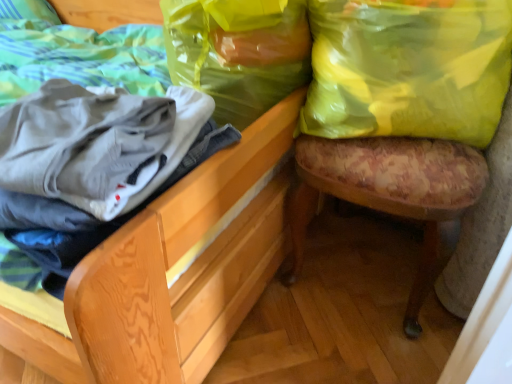
This screenshot has height=384, width=512. What do you see at coordinates (408, 69) in the screenshot?
I see `yellow plastic bag at upper right, which is the 2th shopping bag in left-to-right order` at bounding box center [408, 69].

At what (x,y) coordinates should I click in order to perform the action: click on wooden chair at lower right. Please return your answer as a coordinate pair (x, y). The image size is (512, 384). Looking at the image, I should click on (224, 195).

Image resolution: width=512 pixels, height=384 pixels. Describe the element at coordinates (224, 195) in the screenshot. I see `wooden chair at lower right` at that location.

What do you see at coordinates (238, 52) in the screenshot? I see `translucent yellow plastic bag at upper right, the 1th shopping bag viewed from the left` at bounding box center [238, 52].

Locate an element on the screen. Image resolution: width=512 pixels, height=384 pixels. yellow plastic bag at upper right, which ranks as the 1th shopping bag in right-to-left order is located at coordinates (408, 69).

From the picture: Is floral fabric stool at right taller than wooden chair at lower right?

Incorrect, the height of floral fabric stool at right is not larger of that of wooden chair at lower right.

Is floral fabric stool at right not within wooden chair at lower right?

floral fabric stool at right is positioned outside wooden chair at lower right.

How distant is floral fabric stool at right from wooden chair at lower right?

floral fabric stool at right and wooden chair at lower right are 9.88 inches apart.

Can you confirm if floral fabric stool at right is positioned to the left of wooden chair at lower right?

No.

In terms of width, does translucent yellow plastic bag at upper right, the 1th shopping bag viewed from the left, look wider or thinner when compared to yellow plastic bag at upper right, which is the 2th shopping bag in left-to-right order?

Considering their sizes, translucent yellow plastic bag at upper right, the 1th shopping bag viewed from the left, looks broader than yellow plastic bag at upper right, which is the 2th shopping bag in left-to-right order.

Which is behind, point (249, 103) or point (395, 14)?

The point (249, 103) is farther from the camera.

Is translucent yellow plastic bag at upper right, the 1th shopping bag viewed from the left, far from yellow plastic bag at upper right, which is the 2th shopping bag in left-to-right order?

No.

Consider the image. Relative to yellow plastic bag at upper right, which is the 2th shopping bag in left-to-right order, is translucent yellow plastic bag at upper right, the 1th shopping bag viewed from the left, in front or behind?

translucent yellow plastic bag at upper right, the 1th shopping bag viewed from the left, is behind yellow plastic bag at upper right, which is the 2th shopping bag in left-to-right order.

Relative to wooden chair at lower right, is translucent yellow plastic bag at upper right, the 1th shopping bag viewed from the left, in front or behind?

translucent yellow plastic bag at upper right, the 1th shopping bag viewed from the left, is behind wooden chair at lower right.

Could you tell me if translucent yellow plastic bag at upper right, the 1th shopping bag viewed from the left, is turned towards wooden chair at lower right?

Yes, translucent yellow plastic bag at upper right, the 1th shopping bag viewed from the left, is turned towards wooden chair at lower right.

Is translucent yellow plastic bag at upper right, the 1th shopping bag viewed from the left, far away from wooden chair at lower right?

They are positioned close to each other.

You are a GUI agent. You are given a task and a screenshot of the screen. Output one action in this format:
    pyautogui.click(x=<x>, y=<y>)
    Task: Click on the furniture below the translucent yellow plastic bag at upper right, the 1th shopping bag viewed from the left (from the image's perspective)
    Image resolution: width=512 pixels, height=384 pixels.
    Given the screenshot: What is the action you would take?
    pyautogui.click(x=224, y=195)

Is yellow plastic bag at upper right, which ranks as the 1th shopping bag in right-to-left order, not near wooden chair at lower right?

yellow plastic bag at upper right, which ranks as the 1th shopping bag in right-to-left order, is near wooden chair at lower right, not far away.

Considering the relative positions of yellow plastic bag at upper right, which is the 2th shopping bag in left-to-right order, and wooden chair at lower right in the image provided, is yellow plastic bag at upper right, which is the 2th shopping bag in left-to-right order, to the right of wooden chair at lower right from the viewer's perspective?

Correct, you'll find yellow plastic bag at upper right, which is the 2th shopping bag in left-to-right order, to the right of wooden chair at lower right.

From the image's perspective, is yellow plastic bag at upper right, which ranks as the 1th shopping bag in right-to-left order, on wooden chair at lower right?

Incorrect, from the image's perspective, yellow plastic bag at upper right, which ranks as the 1th shopping bag in right-to-left order, is lower than wooden chair at lower right.

Does floral fabric stool at right appear on the left side of translucent yellow plastic bag at upper right, the 1th shopping bag viewed from the left?

No.

Does floral fabric stool at right have a lesser height compared to translucent yellow plastic bag at upper right, the 1th shopping bag viewed from the left?

No.

Looking at the image, does floral fabric stool at right seem bigger or smaller compared to translucent yellow plastic bag at upper right, which is the second shopping bag in right-to-left order?

Clearly, floral fabric stool at right is larger in size than translucent yellow plastic bag at upper right, which is the second shopping bag in right-to-left order.

Would you say floral fabric stool at right is outside translucent yellow plastic bag at upper right, the 1th shopping bag viewed from the left?

Yes.

From the image's perspective, would you say translucent yellow plastic bag at upper right, which is the second shopping bag in right-to-left order, is positioned over floral fabric stool at right?

Yes.

Would you say translucent yellow plastic bag at upper right, which is the second shopping bag in right-to-left order, contains floral fabric stool at right?

No, floral fabric stool at right is not surrounded by translucent yellow plastic bag at upper right, which is the second shopping bag in right-to-left order.

Is translucent yellow plastic bag at upper right, the 1th shopping bag viewed from the left, positioned before floral fabric stool at right?

No, the depth of translucent yellow plastic bag at upper right, the 1th shopping bag viewed from the left, is greater than that of floral fabric stool at right.

Are wooden chair at lower right and translucent yellow plastic bag at upper right, which is the second shopping bag in right-to-left order, located far from each other?

That's not correct — wooden chair at lower right is a little close to translucent yellow plastic bag at upper right, which is the second shopping bag in right-to-left order.

Considering the relative sizes of wooden chair at lower right and translucent yellow plastic bag at upper right, which is the second shopping bag in right-to-left order, in the image provided, is wooden chair at lower right bigger than translucent yellow plastic bag at upper right, which is the second shopping bag in right-to-left order,?

Indeed, wooden chair at lower right has a larger size compared to translucent yellow plastic bag at upper right, which is the second shopping bag in right-to-left order.

In the scene shown: How much distance is there between wooden chair at lower right and translucent yellow plastic bag at upper right, the 1th shopping bag viewed from the left?

The distance of wooden chair at lower right from translucent yellow plastic bag at upper right, the 1th shopping bag viewed from the left, is 8.59 inches.

Which is in front, point (4, 343) or point (210, 64)?

The point (4, 343) is closer to the camera.

Find the location of a particular element. The height and width of the screenshot is (384, 512). furniture lying above the floral fabric stool at right (from the image's perspective) is located at coordinates (224, 195).

The image size is (512, 384). What are the coordinates of `shopping bag behind the yellow plastic bag at upper right, which ranks as the 1th shopping bag in right-to-left order` in the screenshot? It's located at [238, 52].

Looking at the image, which one is located further to translucent yellow plastic bag at upper right, the 1th shopping bag viewed from the left, yellow plastic bag at upper right, which ranks as the 1th shopping bag in right-to-left order, or wooden chair at lower right?

wooden chair at lower right lies further to translucent yellow plastic bag at upper right, the 1th shopping bag viewed from the left, than the other object.

Consider the image. When comparing their distances from wooden chair at lower right, does floral fabric stool at right or yellow plastic bag at upper right, which ranks as the 1th shopping bag in right-to-left order, seem closer?

Among the two, floral fabric stool at right is located nearer to wooden chair at lower right.

Looking at the image, which one is located further to translucent yellow plastic bag at upper right, the 1th shopping bag viewed from the left, wooden chair at lower right or yellow plastic bag at upper right, which ranks as the 1th shopping bag in right-to-left order?

wooden chair at lower right.

Based on their spatial positions, is wooden chair at lower right or translucent yellow plastic bag at upper right, the 1th shopping bag viewed from the left, closer to yellow plastic bag at upper right, which is the 2th shopping bag in left-to-right order?

The object closer to yellow plastic bag at upper right, which is the 2th shopping bag in left-to-right order, is translucent yellow plastic bag at upper right, the 1th shopping bag viewed from the left.

Estimate the real-world distances between objects in this image. Which object is further from yellow plastic bag at upper right, which is the 2th shopping bag in left-to-right order, wooden chair at lower right or floral fabric stool at right?

The object further to yellow plastic bag at upper right, which is the 2th shopping bag in left-to-right order, is wooden chair at lower right.

From the image, which object appears to be farther from yellow plastic bag at upper right, which ranks as the 1th shopping bag in right-to-left order, translucent yellow plastic bag at upper right, which is the second shopping bag in right-to-left order, or wooden chair at lower right?

wooden chair at lower right is further to yellow plastic bag at upper right, which ranks as the 1th shopping bag in right-to-left order.

Looking at the image, which one is located further to translucent yellow plastic bag at upper right, which is the second shopping bag in right-to-left order, yellow plastic bag at upper right, which ranks as the 1th shopping bag in right-to-left order, or floral fabric stool at right?

Based on the image, floral fabric stool at right appears to be further to translucent yellow plastic bag at upper right, which is the second shopping bag in right-to-left order.

Estimate the real-world distances between objects in this image. Which object is further from wooden chair at lower right, translucent yellow plastic bag at upper right, the 1th shopping bag viewed from the left, or floral fabric stool at right?

Among the two, floral fabric stool at right is located further to wooden chair at lower right.

Identify the location of shopping bag located between translucent yellow plastic bag at upper right, which is the second shopping bag in right-to-left order, and floral fabric stool at right in the left-right direction. (408, 69).

You are a GUI agent. You are given a task and a screenshot of the screen. Output one action in this format:
    pyautogui.click(x=<x>, y=<y>)
    Task: Click on the shopping bag located between wooden chair at lower right and yellow plastic bag at upper right, which ranks as the 1th shopping bag in right-to-left order, in the left-right direction
    The width and height of the screenshot is (512, 384).
    Given the screenshot: What is the action you would take?
    pyautogui.click(x=238, y=52)